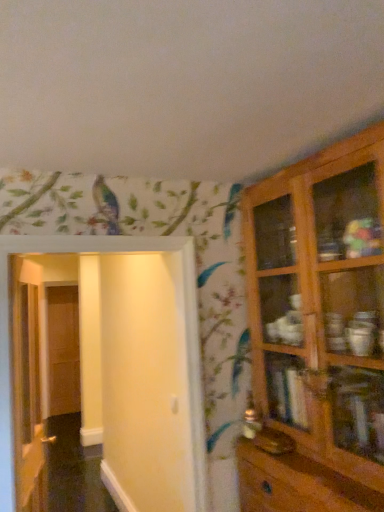
Question: From their relative heights in the image, would you say white glossy door at left, positioned as the 2th door in left-to-right order, is taller or shorter than wooden door at left, placed as the 1th door when sorted from back to front?

Choices:
 (A) short
 (B) tall

Answer: (A)

Question: Is white glossy door at left, positioned as the 2th door in left-to-right order, in front of or behind wooden door at left, the 3th door positioned from the right, in the image?

Choices:
 (A) front
 (B) behind

Answer: (A)

Question: Which object is the closest to the wooden cabinet at right?

Choices:
 (A) white matte door at left, marked as the 3th door in a back-to-front arrangement
 (B) white glossy door at left, which is the 2th door in front-to-back order
 (C) wooden door at left, placed as the 1th door when sorted from back to front

Answer: (A)

Question: Estimate the real-world distances between objects in this image. Which object is farther from the wooden door at left, the first door from the left?

Choices:
 (A) white glossy door at left, positioned as the 2th door in left-to-right order
 (B) wooden cabinet at right
 (C) white matte door at left, marked as the 3th door in a back-to-front arrangement

Answer: (B)